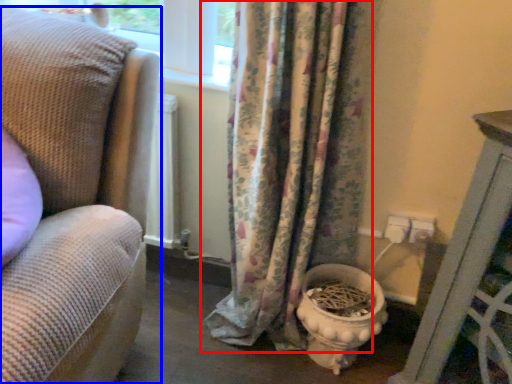
Question: Among these objects, which one is nearest to the camera, curtain (highlighted by a red box) or studio couch (highlighted by a blue box)?

Choices:
 (A) curtain
 (B) studio couch

Answer: (B)